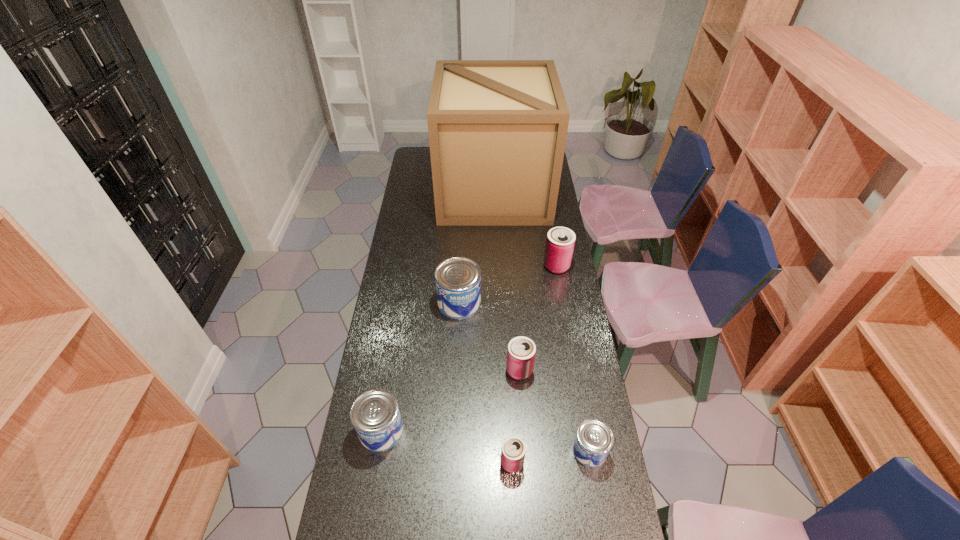
The width and height of the screenshot is (960, 540). I want to click on can that is the second closest one to the smallest pink can, so click(x=521, y=351).

Select which pink can appears as the closest to the smallest pink can. Please provide its 2D coordinates. Your answer should be formatted as a tuple, i.e. [(x, y)], where the tuple contains the x and y coordinates of a point satisfying the conditions above.

[(521, 351)]

Select which pink can appears as the closest to the box. Please provide its 2D coordinates. Your answer should be formatted as a tuple, i.e. [(x, y)], where the tuple contains the x and y coordinates of a point satisfying the conditions above.

[(560, 241)]

The width and height of the screenshot is (960, 540). I want to click on blue can that can be found as the second closest to the tallest object, so click(375, 415).

Choose which blue can is the nearest neighbor to the rightmost blue can. Please provide its 2D coordinates. Your answer should be formatted as a tuple, i.e. [(x, y)], where the tuple contains the x and y coordinates of a point satisfying the conditions above.

[(375, 415)]

Locate an element on the screen. The height and width of the screenshot is (540, 960). blank area in the image that satisfies the following two spatial constraints: 1. on the reinforced sides of the box; 2. on the front label of the farthest blue can is located at coordinates (498, 303).

The height and width of the screenshot is (540, 960). Find the location of `free point that satisfies the following two spatial constraints: 1. on the front label of the second can from left to right; 2. on the right side of the second smallest pink can`. free point that satisfies the following two spatial constraints: 1. on the front label of the second can from left to right; 2. on the right side of the second smallest pink can is located at coordinates (456, 370).

Where is `free region that satisfies the following two spatial constraints: 1. on the front label of the third farthest object; 2. on the front label of the second biggest blue can`? The width and height of the screenshot is (960, 540). free region that satisfies the following two spatial constraints: 1. on the front label of the third farthest object; 2. on the front label of the second biggest blue can is located at coordinates [454, 430].

The height and width of the screenshot is (540, 960). Find the location of `vacant space that satisfies the following two spatial constraints: 1. on the front label of the third farthest object; 2. on the left side of the fourth farthest object`. vacant space that satisfies the following two spatial constraints: 1. on the front label of the third farthest object; 2. on the left side of the fourth farthest object is located at coordinates (456, 370).

This screenshot has width=960, height=540. I want to click on free region that satisfies the following two spatial constraints: 1. on the front label of the second blue can from right to left; 2. on the right side of the fourth farthest object, so click(456, 370).